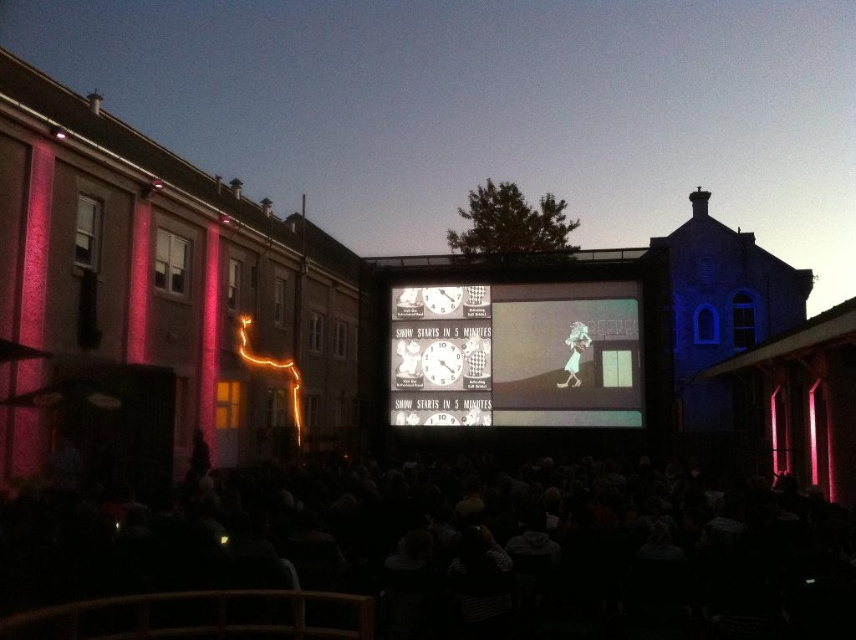
You are a photographer at the movie event. You want to capture a photo of the smooth white dress at center without the black fabric crowd at center blocking it. Is it possible to do so from your current position?

The black fabric crowd at center is in front of the smooth white dress at center, so it is blocking the view. To capture the smooth white dress at center without obstruction, you would need to move to a position where the black fabric crowd at center is no longer in front of it, such as behind the crowd or adjusting your angle to avoid them.

You are setting up a banner that needs to be as wide as the yellow neon lights at left. Can you place it on the matte plastic screen at center without it exceeding the screen width?

The matte plastic screen at center is wider than the yellow neon lights at left, so the banner can be placed on the matte plastic screen at center without exceeding its width.

You are a photographer standing in the courtyard and want to take a photo of both the matte plastic screen at center and the yellow neon lights at left. Which object should you focus on first to ensure both are in sharp focus?

Since the matte plastic screen at center is closer to the viewer than the yellow neon lights at left, you should focus on the matte plastic screen at center first to ensure both are in sharp focus.